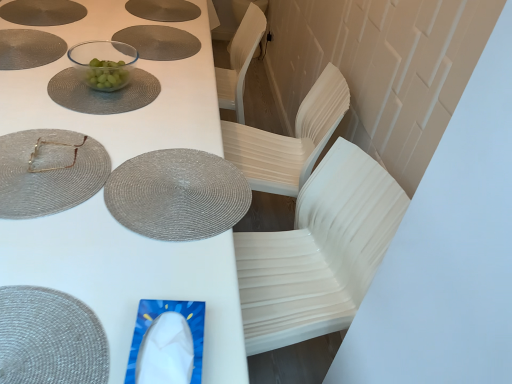
This screenshot has height=384, width=512. What are the coordinates of `vacant space positioned to the left of matte gray placemat at upper center, which appears as the first plate when viewed from the right` in the screenshot? It's located at click(x=67, y=36).